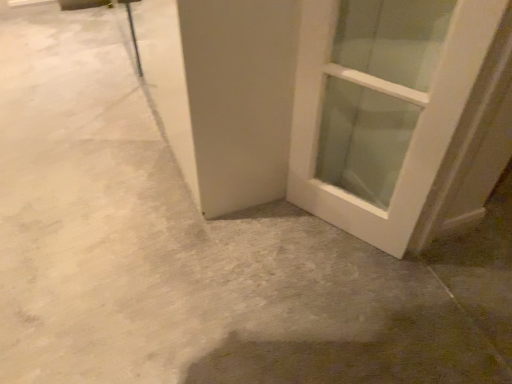
This screenshot has width=512, height=384. Identify the location of blank space to the left of white wooden door at lower right. (274, 235).